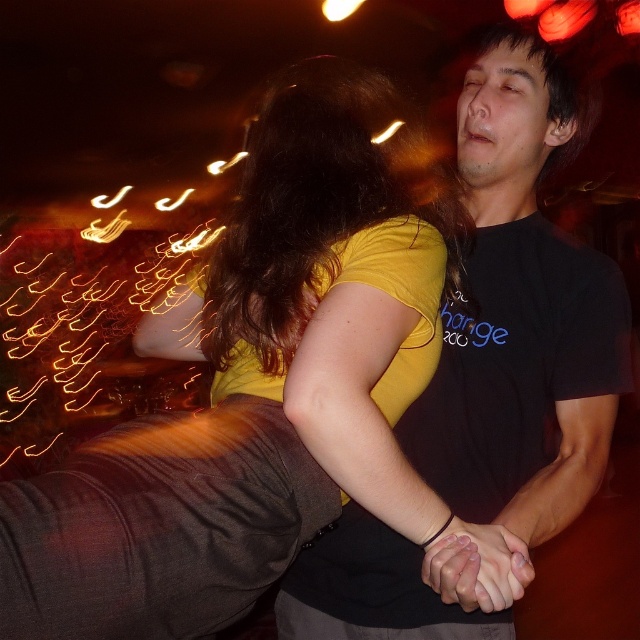
Question: Among these objects, which one is nearest to the camera?

Choices:
 (A) smooth skin hands at center
 (B) brown shiny hair at upper center
 (C) black matte t-shirt at center

Answer: (C)

Question: From the image, what is the correct spatial relationship of brown shiny hair at upper center in relation to smooth skin hands at center?

Choices:
 (A) below
 (B) above

Answer: (B)

Question: Which of the following is the farthest from the observer?

Choices:
 (A) (589, 426)
 (B) (486, 541)
 (C) (301, 195)

Answer: (A)

Question: Is the position of brown shiny hair at upper center less distant than that of smooth skin hands at center?

Choices:
 (A) no
 (B) yes

Answer: (A)

Question: Considering the relative positions of black matte t-shirt at center and brown shiny hair at upper center in the image provided, where is black matte t-shirt at center located with respect to brown shiny hair at upper center?

Choices:
 (A) right
 (B) left

Answer: (A)

Question: Among these objects, which one is farthest from the camera?

Choices:
 (A) black matte t-shirt at center
 (B) brown shiny hair at upper center
 (C) smooth skin hands at center

Answer: (B)